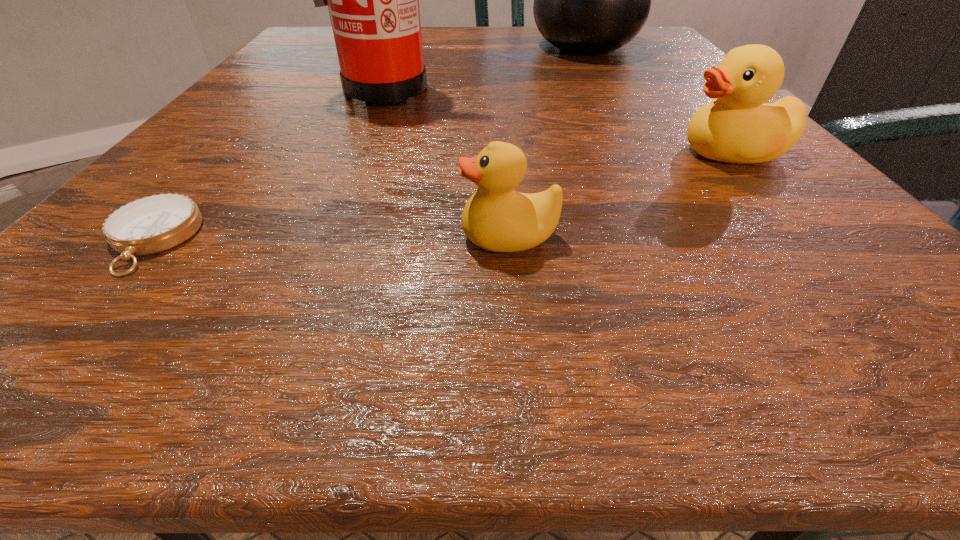
Image resolution: width=960 pixels, height=540 pixels. Find the location of `vacant space that's between the second object from left to right and the compass`. vacant space that's between the second object from left to right and the compass is located at coordinates (267, 165).

You are a GUI agent. You are given a task and a screenshot of the screen. Output one action in this format:
    pyautogui.click(x=<x>, y=<y>)
    Task: Click on the free space between the fire extinguisher and the left duck
    The width and height of the screenshot is (960, 540).
    Given the screenshot: What is the action you would take?
    pyautogui.click(x=445, y=164)

Locate an element on the screen. This screenshot has height=540, width=960. free space between the third nearest object and the compass is located at coordinates (441, 195).

Where is `unoccupied area between the taller duck and the third object from right to left`? This screenshot has width=960, height=540. unoccupied area between the taller duck and the third object from right to left is located at coordinates (619, 194).

Locate an element on the screen. The height and width of the screenshot is (540, 960). vacant region between the farthest object and the farther duck is located at coordinates (658, 99).

At what (x,y) coordinates should I click in order to perform the action: click on empty location between the shortest object and the vase. Please return your answer as a coordinate pair (x, y). The image size is (960, 540). Looking at the image, I should click on (369, 143).

You are a GUI agent. You are given a task and a screenshot of the screen. Output one action in this format:
    pyautogui.click(x=<x>, y=<y>)
    Task: Click on the free space between the taller duck and the nearer duck
    This screenshot has width=960, height=540.
    Given the screenshot: What is the action you would take?
    pyautogui.click(x=619, y=194)

Where is `free space between the leftmost object and the fourth shortest object`? free space between the leftmost object and the fourth shortest object is located at coordinates (369, 143).

At what (x,y) coordinates should I click in order to perform the action: click on empty space that is in between the third farthest object and the fire extinguisher. Please return your answer as a coordinate pair (x, y). This screenshot has height=540, width=960. Looking at the image, I should click on (556, 122).

The height and width of the screenshot is (540, 960). Identify the location of vacant area that lies between the shortest object and the right duck. (441, 195).